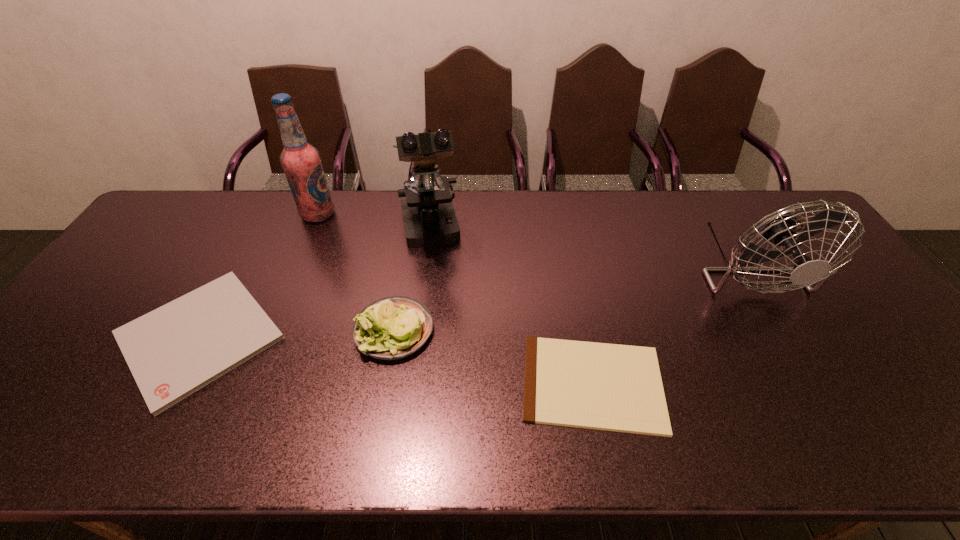
Find the location of a particular element. object that is positioned at the right edge is located at coordinates (780, 229).

Locate an element on the screen. The height and width of the screenshot is (540, 960). object positioned at the far right corner is located at coordinates click(780, 229).

Locate an element on the screen. The image size is (960, 540). free point at the far edge is located at coordinates (716, 192).

Identify the location of vacant region at the near edge of the desktop. (347, 442).

What are the coordinates of `free space at the left edge` in the screenshot? It's located at (143, 286).

Find the location of a particular element. The image size is (960, 540). vacant space at the near right corner is located at coordinates (954, 446).

What are the coordinates of `vacant area between the left clipboard and the lettuce` in the screenshot? It's located at (297, 333).

At what (x,y) coordinates should I click in order to perform the action: click on free spot between the third shortest object and the second object from right to left. Please return your answer as a coordinate pair (x, y). Looking at the image, I should click on (493, 357).

The image size is (960, 540). In order to click on free space that is in between the alcohol and the second shortest object in this screenshot , I will do `click(259, 275)`.

Locate an element on the screen. vacant region between the lettuce and the alcohol is located at coordinates (356, 272).